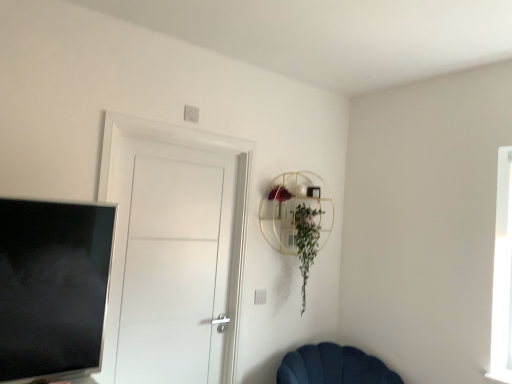
Where is `green leafy plant at upper center`? This screenshot has height=384, width=512. green leafy plant at upper center is located at coordinates (297, 219).

Does silver metallic tv at left have a smaller size compared to green leafy plant at upper center?

Answer: Incorrect, silver metallic tv at left is not smaller in size than green leafy plant at upper center.

Between point (9, 243) and point (272, 246), which one is positioned in front?

The point (9, 243) is more forward.

Could green leafy plant at upper center be considered to be inside silver metallic tv at left?

No, silver metallic tv at left does not contain green leafy plant at upper center.

Is white matte door at center positioned with its back to silver metallic tv at left?

white matte door at center does not have its back to silver metallic tv at left.

The image size is (512, 384). I want to click on television below the white matte door at center (from a real-world perspective), so click(52, 286).

Considering the sizes of objects white matte door at center and silver metallic tv at left in the image provided, who is shorter, white matte door at center or silver metallic tv at left?

silver metallic tv at left is shorter.

From a real-world perspective, is white matte door at center over silver metallic tv at left?

Yes.

From a real-world perspective, does velvet dark blue chair at lower center sit lower than silver metallic tv at left?

Yes, from a real-world perspective, velvet dark blue chair at lower center is below silver metallic tv at left.

Is velvet dark blue chair at lower center beside silver metallic tv at left?

velvet dark blue chair at lower center and silver metallic tv at left are clearly separated.

Is velvet dark blue chair at lower center at the left side of silver metallic tv at left?

Incorrect, velvet dark blue chair at lower center is not on the left side of silver metallic tv at left.

Does point (288, 370) come farther from viewer compared to point (76, 280)?

That is True.

Can you confirm if silver metallic tv at left is wider than white matte door at center?

Yes, silver metallic tv at left is wider than white matte door at center.

Is silver metallic tv at left oriented towards white matte door at center?

No, silver metallic tv at left is not facing towards white matte door at center.

Is the surface of silver metallic tv at left in direct contact with white matte door at center?

No, silver metallic tv at left is not with white matte door at center.

Considering the positions of objects silver metallic tv at left and white matte door at center in the image provided, who is behind, silver metallic tv at left or white matte door at center?

white matte door at center is further away from the camera.

Considering the sizes of objects green leafy plant at upper center and velvet dark blue chair at lower center in the image provided, who is bigger, green leafy plant at upper center or velvet dark blue chair at lower center?

velvet dark blue chair at lower center is bigger.

From a real-world perspective, which is physically above, green leafy plant at upper center or velvet dark blue chair at lower center?

In real-world perspective, green leafy plant at upper center is above.

From the image's perspective, between green leafy plant at upper center and velvet dark blue chair at lower center, who is located below?

velvet dark blue chair at lower center, from the image's perspective.

Can you confirm if green leafy plant at upper center is positioned to the left of silver metallic tv at left?

No, green leafy plant at upper center is not to the left of silver metallic tv at left.

Could you tell me if green leafy plant at upper center is turned towards silver metallic tv at left?

No.

Are green leafy plant at upper center and silver metallic tv at left beside each other?

No, green leafy plant at upper center is not making contact with silver metallic tv at left.

Considering the relative positions of white matte door at center and velvet dark blue chair at lower center in the image provided, is white matte door at center to the right of velvet dark blue chair at lower center from the viewer's perspective?

In fact, white matte door at center is to the left of velvet dark blue chair at lower center.

Can you tell me how much white matte door at center and velvet dark blue chair at lower center differ in facing direction?

The facing directions of white matte door at center and velvet dark blue chair at lower center are 21.7 degrees apart.

Does point (225, 368) lie in front of point (353, 364)?

Yes, it is.

This screenshot has height=384, width=512. Identify the location of floral arrangement behind the silver metallic tv at left. (297, 219).

Locate an element on the screen. television on the left side of white matte door at center is located at coordinates (52, 286).

When comparing their distances from green leafy plant at upper center, does silver metallic tv at left or white matte door at center seem closer?

white matte door at center is closer to green leafy plant at upper center.

Which object lies nearer to the anchor point white matte door at center, velvet dark blue chair at lower center or silver metallic tv at left?

The object closer to white matte door at center is silver metallic tv at left.

Considering their positions, is velvet dark blue chair at lower center positioned closer to white matte door at center than green leafy plant at upper center?

green leafy plant at upper center is positioned closer to the anchor white matte door at center.

Based on their spatial positions, is silver metallic tv at left or green leafy plant at upper center further from white matte door at center?

silver metallic tv at left lies further to white matte door at center than the other object.

Estimate the real-world distances between objects in this image. Which object is closer to white matte door at center, green leafy plant at upper center or velvet dark blue chair at lower center?

Among the two, green leafy plant at upper center is located nearer to white matte door at center.

From the image, which object appears to be farther from silver metallic tv at left, white matte door at center or green leafy plant at upper center?

Among the two, green leafy plant at upper center is located further to silver metallic tv at left.

From the image, which object appears to be nearer to silver metallic tv at left, white matte door at center or velvet dark blue chair at lower center?

Among the two, white matte door at center is located nearer to silver metallic tv at left.

Looking at this image, when comparing their distances from green leafy plant at upper center, does white matte door at center or silver metallic tv at left seem closer?

The object closer to green leafy plant at upper center is white matte door at center.

Where is `door between silver metallic tv at left and green leafy plant at upper center along the z-axis`? This screenshot has width=512, height=384. door between silver metallic tv at left and green leafy plant at upper center along the z-axis is located at coordinates (174, 250).

What are the coordinates of `floral arrangement located between white matte door at center and velvet dark blue chair at lower center in the left-right direction` in the screenshot? It's located at (297, 219).

Locate an element on the screen. The image size is (512, 384). floral arrangement situated between silver metallic tv at left and velvet dark blue chair at lower center from left to right is located at coordinates (297, 219).

I want to click on door between silver metallic tv at left and velvet dark blue chair at lower center in the horizontal direction, so click(x=174, y=250).